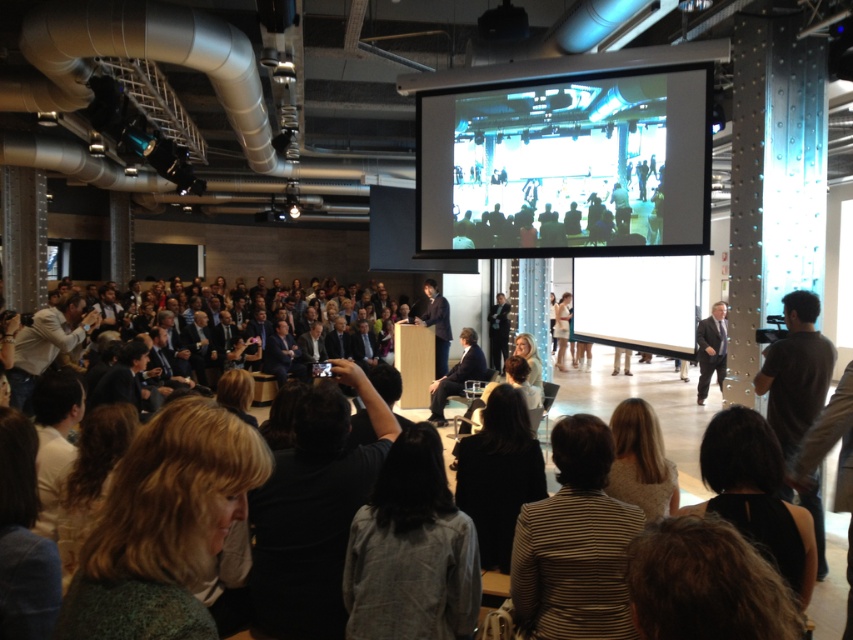
Question: Among these points, which one is nearest to the camera?

Choices:
 (A) (566, 342)
 (B) (611, 477)

Answer: (B)

Question: Which of the following is the closest to the observer?

Choices:
 (A) dark gray sweater at center
 (B) dark brown hair at lower center
 (C) dark gray shirt at right

Answer: (B)

Question: Is green textured sweater at lower left positioned in front of denim jacket at lower left?

Choices:
 (A) no
 (B) yes

Answer: (B)

Question: Is dark gray shirt at center further to the viewer compared to dark gray shirt at right?

Choices:
 (A) yes
 (B) no

Answer: (B)

Question: Which object is the closest to the green textured sweater at lower left?

Choices:
 (A) black fabric at lower right
 (B) dark gray shirt at center
 (C) gray fabric jacket at lower center
 (D) light brown leather jacket at left

Answer: (C)

Question: In this image, where is dark gray suit at center located relative to light beige fabric dress at center?

Choices:
 (A) left
 (B) right

Answer: (A)